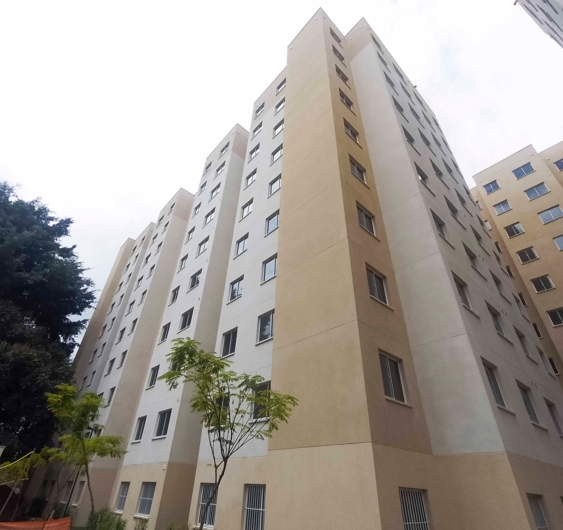
Identify the location of floors of building. Image resolution: width=563 pixels, height=530 pixels. (250, 494), (258, 403), (266, 326), (266, 266), (270, 224), (272, 183), (274, 155), (276, 129), (280, 103), (280, 87).